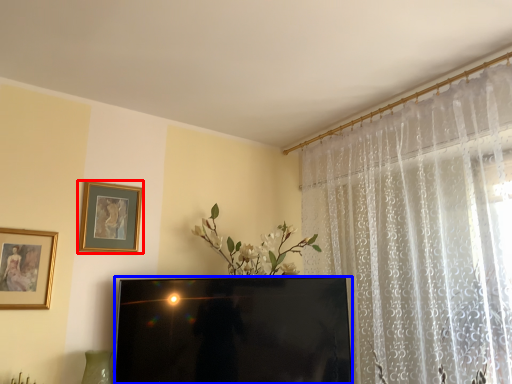
Question: Which object appears farthest to the camera in this image, picture frame (highlighted by a red box) or television (highlighted by a blue box)?

Choices:
 (A) picture frame
 (B) television

Answer: (A)